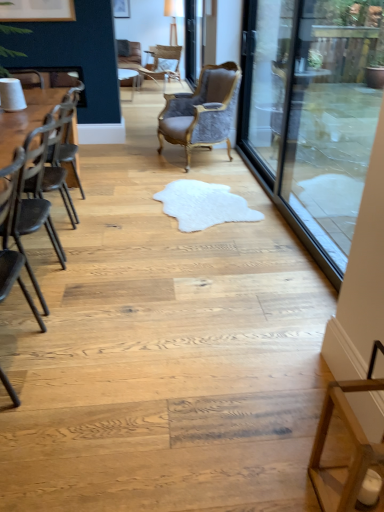
Question: Considering the relative sizes of wooden table at left and matte white picture frame at upper left in the image provided, is wooden table at left thinner than matte white picture frame at upper left?

Choices:
 (A) yes
 (B) no

Answer: (B)

Question: From a real-world perspective, is wooden table at left positioned over matte white picture frame at upper left based on gravity?

Choices:
 (A) no
 (B) yes

Answer: (A)

Question: Is wooden table at left positioned with its back to matte white picture frame at upper left?

Choices:
 (A) yes
 (B) no

Answer: (B)

Question: Does wooden table at left have a greater width compared to matte white picture frame at upper left?

Choices:
 (A) yes
 (B) no

Answer: (A)

Question: Could matte white picture frame at upper left be considered to be inside wooden table at left?

Choices:
 (A) yes
 (B) no

Answer: (B)

Question: In terms of width, does velvet grey chair at center, the 2th chair positioned from the back, look wider or thinner when compared to wooden table at left?

Choices:
 (A) wide
 (B) thin

Answer: (A)

Question: Based on their positions, is velvet grey chair at center, the 2th chair positioned from the back, located to the left or right of wooden table at left?

Choices:
 (A) left
 (B) right

Answer: (B)

Question: From a real-world perspective, is velvet grey chair at center, acting as the third chair starting from the bottom, positioned above or below wooden table at left?

Choices:
 (A) above
 (B) below

Answer: (A)

Question: Looking at the image, does velvet grey chair at center, marked as the 2th chair in a top-to-bottom arrangement, seem bigger or smaller compared to wooden table at left?

Choices:
 (A) small
 (B) big

Answer: (B)

Question: In the image, is light brown woven chair at upper center, positioned as the fourth chair in bottom-to-top order, positioned in front of or behind matte white picture frame at upper left?

Choices:
 (A) behind
 (B) front

Answer: (B)

Question: Is light brown woven chair at upper center, positioned as the fourth chair in bottom-to-top order, taller or shorter than matte white picture frame at upper left?

Choices:
 (A) short
 (B) tall

Answer: (B)

Question: Based on their sizes in the image, would you say light brown woven chair at upper center, the fourth chair when ordered from front to back, is bigger or smaller than matte white picture frame at upper left?

Choices:
 (A) big
 (B) small

Answer: (A)

Question: From the image's perspective, is light brown woven chair at upper center, positioned as the 1th chair in top-to-bottom order, located above or below matte white picture frame at upper left?

Choices:
 (A) above
 (B) below

Answer: (B)

Question: From a real-world perspective, relative to clear glass screen door at upper center, arranged as the 1th screen door when viewed from the left, is black metal chair at left, which ranks as the first chair in bottom-to-top order, vertically above or below?

Choices:
 (A) above
 (B) below

Answer: (B)

Question: Considering the positions of black metal chair at left, the first chair viewed from the front, and clear glass screen door at upper center, which appears as the first screen door when viewed from the back, in the image, is black metal chair at left, the first chair viewed from the front, taller or shorter than clear glass screen door at upper center, which appears as the first screen door when viewed from the back,?

Choices:
 (A) tall
 (B) short

Answer: (B)